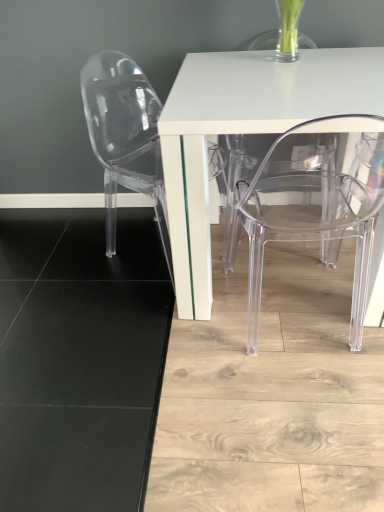
Locate an element on the screen. free area below transparent acrylic chair at lower right, which is the 2th chair in left-to-right order (from a real-world perspective) is located at coordinates (294, 338).